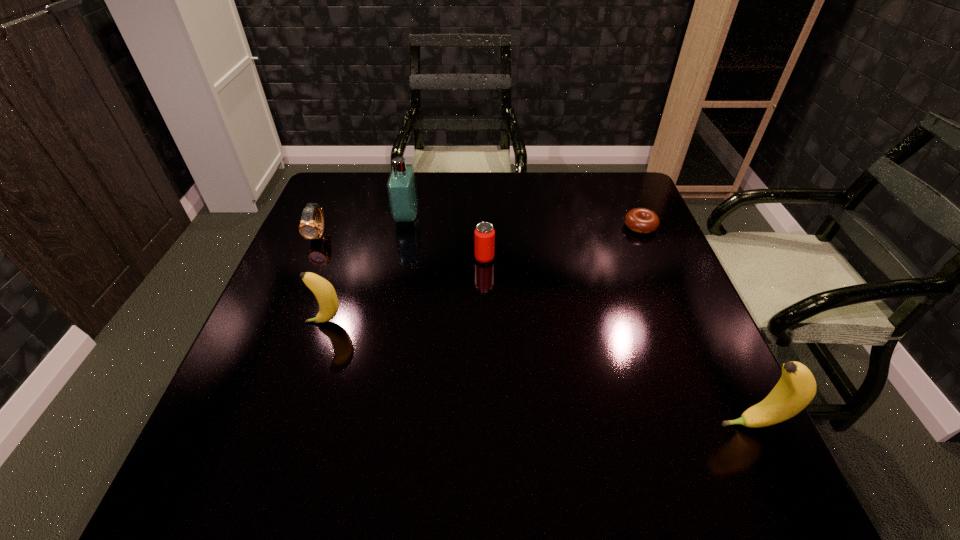
Please mark a free spot for a new banana to balance the arrangement. Please provide its 2D coordinates. Your answer should be formatted as a tuple, i.e. [(x, y)], where the tuple contains the x and y coordinates of a point satisfying the conditions above.

[(516, 368)]